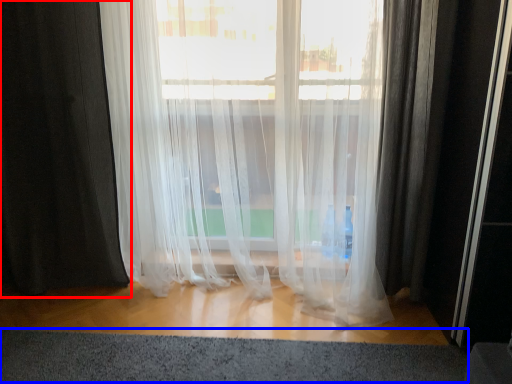
Question: Which of the following is the closest to the observer, curtain (highlighted by a red box) or gray (highlighted by a blue box)?

Choices:
 (A) curtain
 (B) gray

Answer: (B)